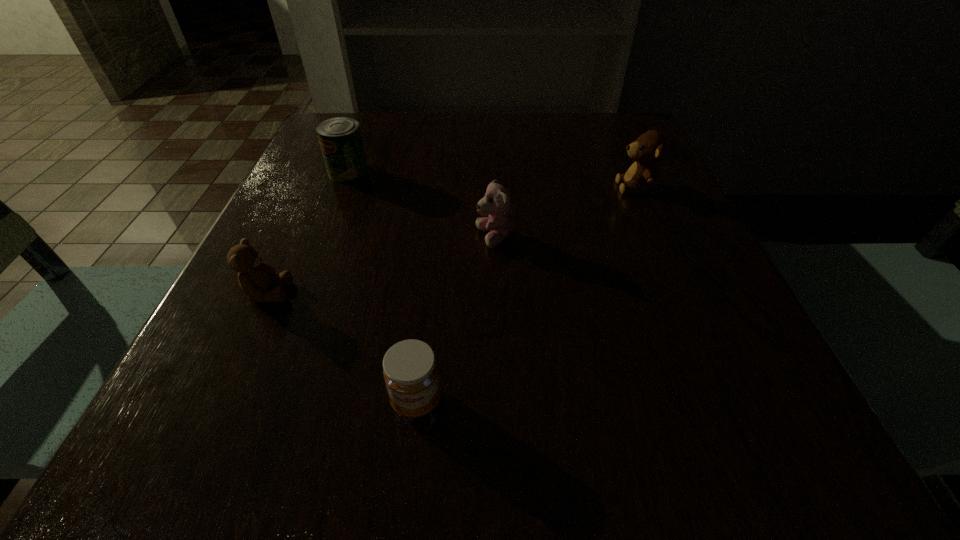
Identify which teddy bear is the closest to the nearest teddy bear. Please provide its 2D coordinates. Your answer should be formatted as a tuple, i.e. [(x, y)], where the tuple contains the x and y coordinates of a point satisfying the conditions above.

[(496, 204)]

Select which teddy bear appears as the closest to the rightmost teddy bear. Please provide its 2D coordinates. Your answer should be formatted as a tuple, i.e. [(x, y)], where the tuple contains the x and y coordinates of a point satisfying the conditions above.

[(496, 204)]

This screenshot has height=540, width=960. In order to click on free spot that satisfies the following two spatial constraints: 1. at the face of the second object from right to left; 2. on the front label of the third object from left to right in this screenshot , I will do `click(499, 401)`.

You are a GUI agent. You are given a task and a screenshot of the screen. Output one action in this format:
    pyautogui.click(x=<x>, y=<y>)
    Task: Click on the free space that satisfies the following two spatial constraints: 1. on the face of the rightmost teddy bear; 2. on the front label of the third object from left to right
    This screenshot has height=540, width=960.
    Given the screenshot: What is the action you would take?
    pyautogui.click(x=730, y=401)

Locate an element on the screen. The width and height of the screenshot is (960, 540). free space that satisfies the following two spatial constraints: 1. at the face of the second teddy bear from right to left; 2. on the front label of the nearest object is located at coordinates (499, 401).